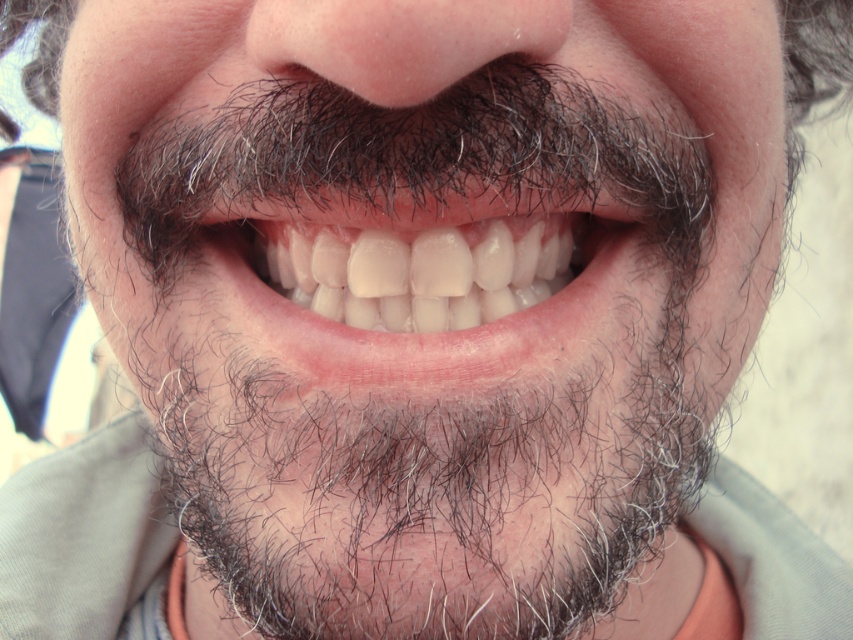
Who is higher up, natural white teeth at center or gray beard at lower center?

Positioned higher is natural white teeth at center.

This screenshot has height=640, width=853. Find the location of `natural white teeth at center`. natural white teeth at center is located at coordinates (426, 280).

What are the coordinates of `natural white teeth at center` in the screenshot? It's located at (426, 280).

Locate an element on the screen. The image size is (853, 640). natural white teeth at center is located at coordinates coord(426,280).